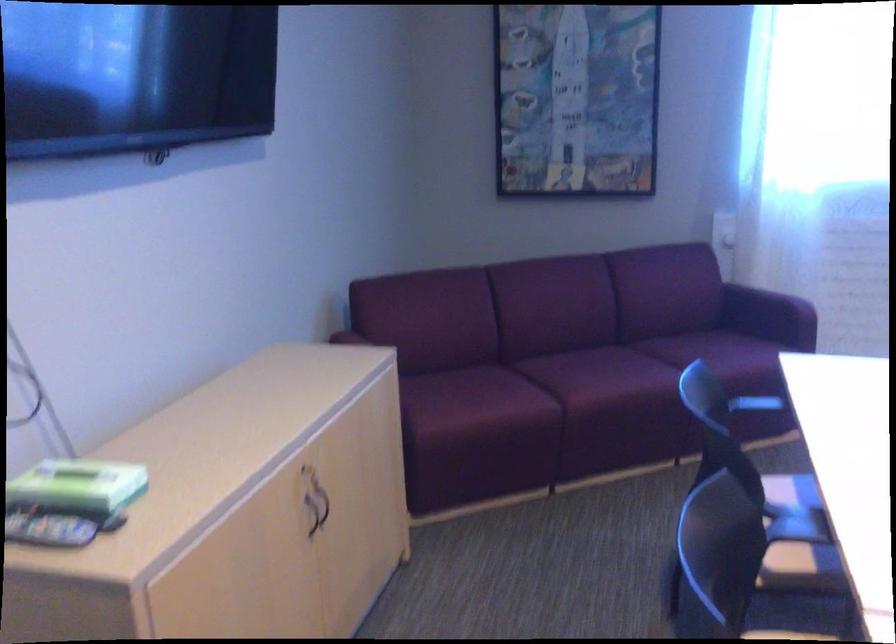
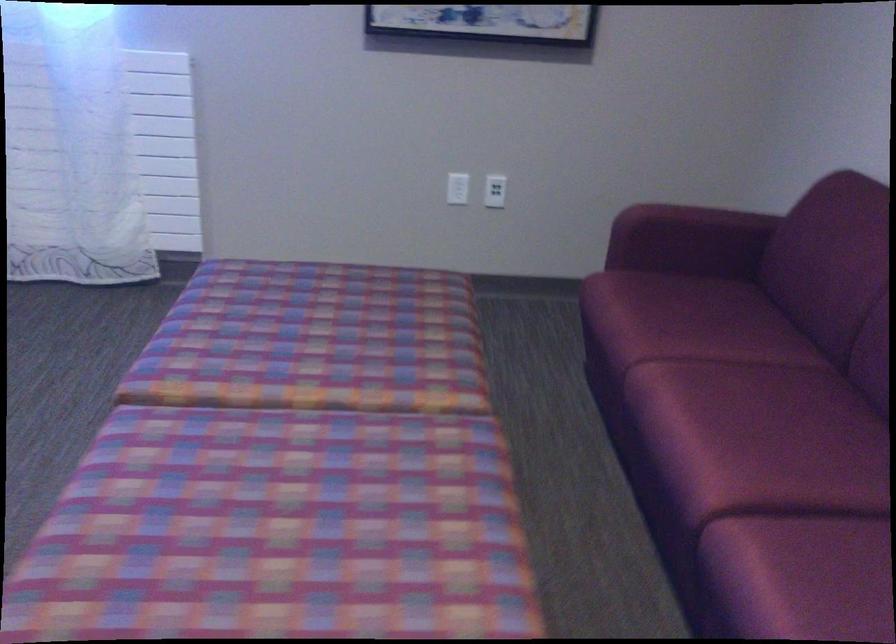
Question: Which direction would the cameraman need to move to produce the second image? Reply with the corresponding letter.

Choices:
 (A) Left
 (B) Right
 (C) Forward
 (D) Backward

Answer: (B)